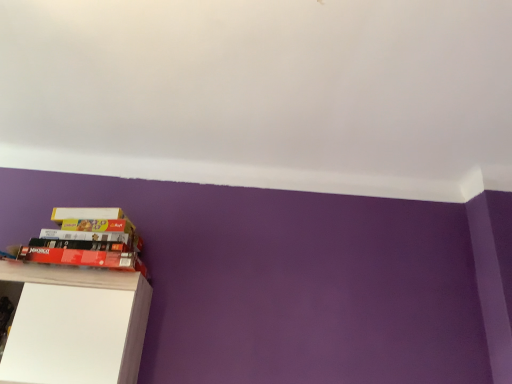
Question: Is white matte cabinet at lower left far away from red matte paperback book at lower left, which is counted as the second paperback book, starting from the top?

Choices:
 (A) yes
 (B) no

Answer: (B)

Question: Is white matte cabinet at lower left surrounding red matte paperback book at lower left, which is counted as the second paperback book, starting from the top?

Choices:
 (A) yes
 (B) no

Answer: (B)

Question: Is white matte cabinet at lower left placed right next to red matte paperback book at lower left, which is the first paperback book in bottom-to-top order?

Choices:
 (A) no
 (B) yes

Answer: (A)

Question: From the image's perspective, is white matte cabinet at lower left on red matte paperback book at lower left, which is the first paperback book in bottom-to-top order?

Choices:
 (A) yes
 (B) no

Answer: (B)

Question: Considering the relative positions of white matte cabinet at lower left and red matte paperback book at lower left, which is the first paperback book in bottom-to-top order, in the image provided, is white matte cabinet at lower left to the right of red matte paperback book at lower left, which is the first paperback book in bottom-to-top order, from the viewer's perspective?

Choices:
 (A) no
 (B) yes

Answer: (A)

Question: From the image's perspective, is white matte cabinet at lower left below red matte paperback book at lower left, which is counted as the second paperback book, starting from the top?

Choices:
 (A) no
 (B) yes

Answer: (B)

Question: Is white matte book at upper left, the first paperback book viewed from the top, facing away from red matte paperback book at lower left, which is the first paperback book in bottom-to-top order?

Choices:
 (A) yes
 (B) no

Answer: (B)

Question: Can you confirm if white matte book at upper left, acting as the 2th paperback book starting from the bottom, is thinner than red matte paperback book at lower left, which is the first paperback book in bottom-to-top order?

Choices:
 (A) yes
 (B) no

Answer: (A)

Question: Does white matte book at upper left, the first paperback book viewed from the top, have a larger size compared to red matte paperback book at lower left, which is the first paperback book in bottom-to-top order?

Choices:
 (A) no
 (B) yes

Answer: (A)

Question: Is white matte book at upper left, the first paperback book viewed from the top, touching red matte paperback book at lower left, which is the first paperback book in bottom-to-top order?

Choices:
 (A) yes
 (B) no

Answer: (B)

Question: Does white matte book at upper left, the first paperback book viewed from the top, have a greater height compared to red matte paperback book at lower left, which is counted as the second paperback book, starting from the top?

Choices:
 (A) no
 (B) yes

Answer: (B)

Question: Considering the relative positions of white matte book at upper left, the first paperback book viewed from the top, and red matte paperback book at lower left, which is counted as the second paperback book, starting from the top, in the image provided, is white matte book at upper left, the first paperback book viewed from the top, behind red matte paperback book at lower left, which is counted as the second paperback book, starting from the top,?

Choices:
 (A) no
 (B) yes

Answer: (B)

Question: Is white matte book at upper left, acting as the 2th paperback book starting from the bottom, surrounded by white matte cabinet at lower left?

Choices:
 (A) no
 (B) yes

Answer: (A)